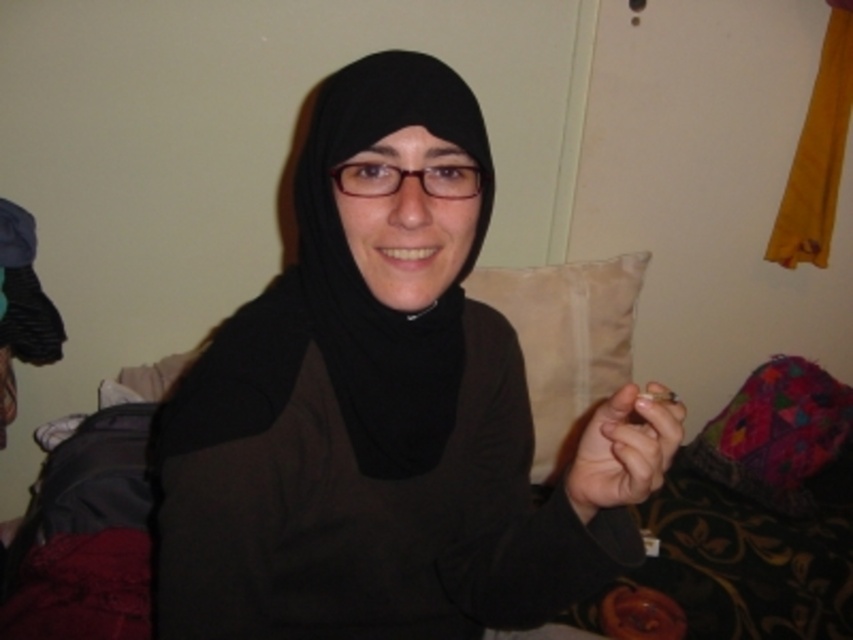
Question: Among these points, which one is farthest from the camera?

Choices:
 (A) (660, 456)
 (B) (335, 230)
 (C) (294, 184)

Answer: (C)

Question: Does black matte scarf at center appear on the right side of smooth skin at center?

Choices:
 (A) yes
 (B) no

Answer: (B)

Question: Which point is closer to the camera taking this photo?

Choices:
 (A) (453, 573)
 (B) (619, 413)
 (C) (334, 104)

Answer: (B)

Question: Is black matte scarf at center thinner than smooth skin at center?

Choices:
 (A) no
 (B) yes

Answer: (A)

Question: Which of the following is the closest to the observer?

Choices:
 (A) (595, 470)
 (B) (315, 218)
 (C) (358, 435)

Answer: (A)

Question: Where is black matte scarf at center located in relation to smooth skin at center in the image?

Choices:
 (A) right
 (B) left

Answer: (B)